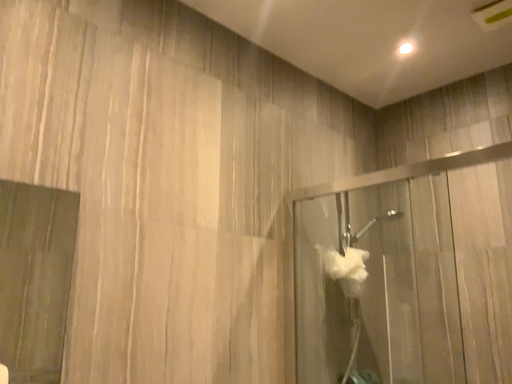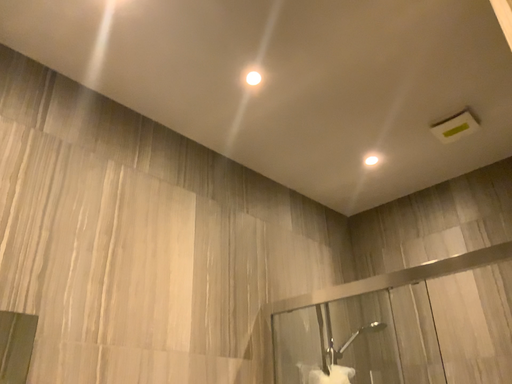
Question: Which way did the camera rotate in the video?

Choices:
 (A) rotated upward
 (B) rotated downward

Answer: (A)